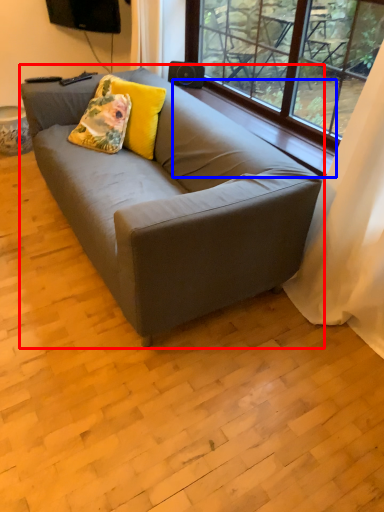
Question: Which of the following is the farthest to the observer, studio couch (highlighted by a red box) or window sill (highlighted by a blue box)?

Choices:
 (A) studio couch
 (B) window sill

Answer: (B)